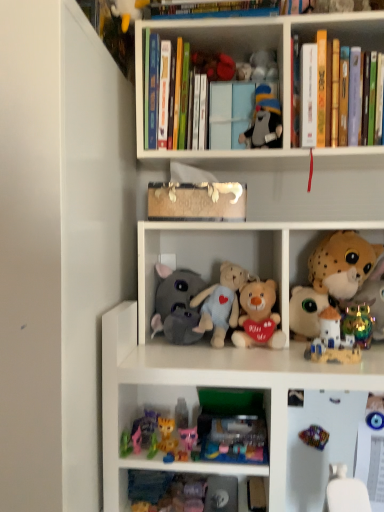
Question: From the image's perspective, does soft plush toys at center, the second shelf in the top-to-bottom sequence, appear lower than gray fabric stuffed animal at upper center, positioned as the first toy in top-to-bottom order?

Choices:
 (A) no
 (B) yes

Answer: (B)

Question: From the image's perspective, is soft plush toys at center, which appears as the first shelf when ordered from the bottom, over gray fabric stuffed animal at upper center, positioned as the first toy in top-to-bottom order?

Choices:
 (A) yes
 (B) no

Answer: (B)

Question: Does soft plush toys at center, the second shelf in the top-to-bottom sequence, have a greater width compared to gray fabric stuffed animal at upper center, marked as the ninth toy in a bottom-to-top arrangement?

Choices:
 (A) yes
 (B) no

Answer: (A)

Question: Considering the relative positions of soft plush toys at center, the second shelf in the top-to-bottom sequence, and gray fabric stuffed animal at upper center, marked as the ninth toy in a bottom-to-top arrangement, in the image provided, is soft plush toys at center, the second shelf in the top-to-bottom sequence, behind gray fabric stuffed animal at upper center, marked as the ninth toy in a bottom-to-top arrangement,?

Choices:
 (A) yes
 (B) no

Answer: (B)

Question: Is soft plush toys at center, which appears as the first shelf when ordered from the bottom, not inside gray fabric stuffed animal at upper center, positioned as the first toy in top-to-bottom order?

Choices:
 (A) yes
 (B) no

Answer: (A)

Question: Considering the positions of fluffy white stuffed animal at right, which appears as the 2th toy when viewed from the top, and gray fabric stuffed animal at upper center, marked as the ninth toy in a bottom-to-top arrangement, in the image, is fluffy white stuffed animal at right, which appears as the 2th toy when viewed from the top, bigger or smaller than gray fabric stuffed animal at upper center, marked as the ninth toy in a bottom-to-top arrangement,?

Choices:
 (A) big
 (B) small

Answer: (A)

Question: Does point (339, 272) appear closer or farther from the camera than point (251, 131)?

Choices:
 (A) closer
 (B) farther

Answer: (B)

Question: Relative to gray fabric stuffed animal at upper center, marked as the ninth toy in a bottom-to-top arrangement, is fluffy white stuffed animal at right, placed as the eighth toy when sorted from bottom to top, in front or behind?

Choices:
 (A) behind
 (B) front

Answer: (A)

Question: Considering the relative positions of fluffy white stuffed animal at right, placed as the eighth toy when sorted from bottom to top, and gray fabric stuffed animal at upper center, marked as the ninth toy in a bottom-to-top arrangement, in the image provided, is fluffy white stuffed animal at right, placed as the eighth toy when sorted from bottom to top, to the left or to the right of gray fabric stuffed animal at upper center, marked as the ninth toy in a bottom-to-top arrangement,?

Choices:
 (A) right
 (B) left

Answer: (A)

Question: Based on their sizes in the image, would you say rainbow metallic figurine at right, which is the third toy from bottom to top, is bigger or smaller than hardcover book at upper right, the second book when ordered from right to left?

Choices:
 (A) big
 (B) small

Answer: (B)

Question: From a real-world perspective, relative to hardcover book at upper right, the second book viewed from the left, is rainbow metallic figurine at right, which is the third toy from bottom to top, vertically above or below?

Choices:
 (A) above
 (B) below

Answer: (B)

Question: Based on their positions, is rainbow metallic figurine at right, which is the third toy from bottom to top, located to the left or right of hardcover book at upper right, the second book when ordered from right to left?

Choices:
 (A) left
 (B) right

Answer: (B)

Question: In the image, is rainbow metallic figurine at right, the seventh toy positioned from the top, positioned in front of or behind hardcover book at upper right, the second book when ordered from right to left?

Choices:
 (A) behind
 (B) front

Answer: (A)

Question: Do you think matte plastic castle at center right, the sixth toy positioned from the top, is within rainbow metallic figurine at right, the seventh toy positioned from the top, or outside of it?

Choices:
 (A) outside
 (B) inside

Answer: (A)

Question: In the image, is matte plastic castle at center right, the sixth toy positioned from the top, positioned in front of or behind rainbow metallic figurine at right, which is the third toy from bottom to top?

Choices:
 (A) front
 (B) behind

Answer: (A)